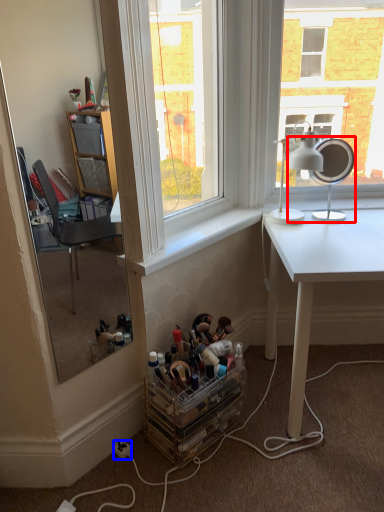
Question: Which object appears farthest to the camera in this image, table lamp (highlighted by a red box) or power outlet (highlighted by a blue box)?

Choices:
 (A) table lamp
 (B) power outlet

Answer: (A)